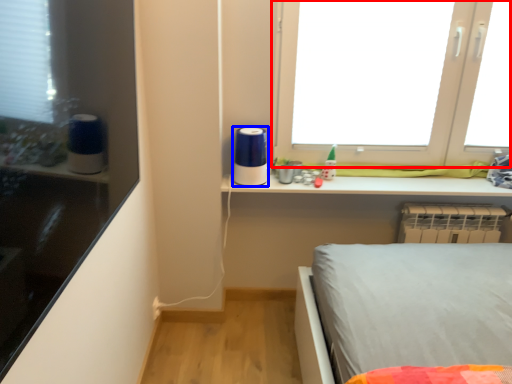
Question: Which point is closer to the camera, window (highlighted by a red box) or appliance (highlighted by a blue box)?

Choices:
 (A) window
 (B) appliance

Answer: (A)